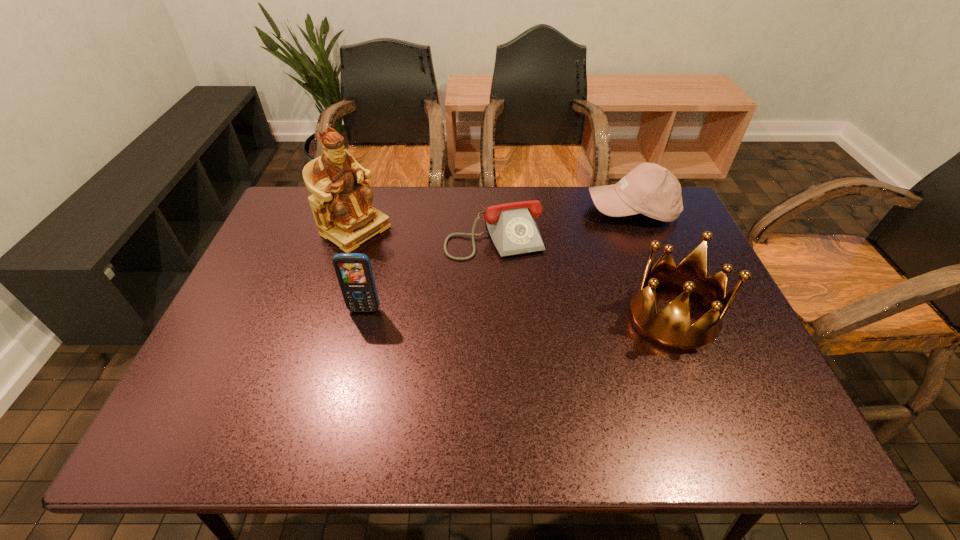
Locate an element on the screen. vacant region at the near left corner of the desktop is located at coordinates (204, 376).

The height and width of the screenshot is (540, 960). I want to click on empty space between the baseball cap and the shortest object, so click(563, 221).

Identify the location of vacant area that lies between the crown and the tallest object. This screenshot has width=960, height=540. (514, 274).

Locate an element on the screen. This screenshot has height=540, width=960. unoccupied area between the cellular telephone and the second shortest object is located at coordinates (497, 260).

Image resolution: width=960 pixels, height=540 pixels. Find the location of `empty space that is in between the figurine and the crown`. empty space that is in between the figurine and the crown is located at coordinates (514, 274).

Find the location of a particular element. Image resolution: width=960 pixels, height=540 pixels. free area in between the cellular telephone and the crown is located at coordinates (x=518, y=314).

Identify the location of vacant space in between the cellular telephone and the crown. The width and height of the screenshot is (960, 540). (518, 314).

Identify the location of free spot between the cellular telephone and the second shortest object. coord(497,260).

Identify which object is the third nearest to the crown. Please provide its 2D coordinates. Your answer should be formatted as a tuple, i.e. [(x, y)], where the tuple contains the x and y coordinates of a point satisfying the conditions above.

[(354, 273)]

Identify which object is the nearest to the fourth tallest object. Please provide its 2D coordinates. Your answer should be formatted as a tuple, i.e. [(x, y)], where the tuple contains the x and y coordinates of a point satisfying the conditions above.

[(512, 227)]